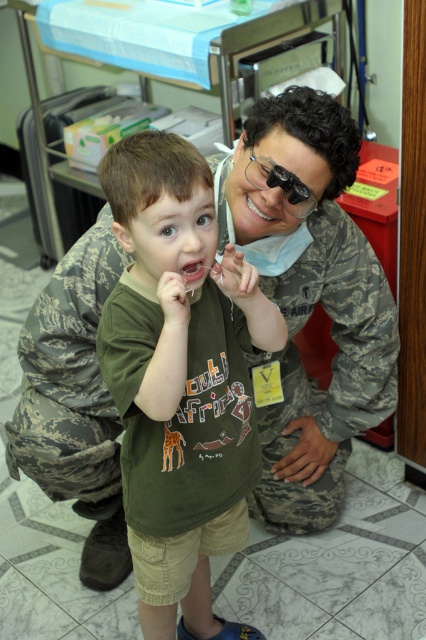
Question: Among these objects, which one is nearest to the camera?

Choices:
 (A) camouflage uniform at center
 (B) green matte shirt at center

Answer: (B)

Question: In this image, where is camouflage uniform at center located relative to green matte shirt at center?

Choices:
 (A) below
 (B) above

Answer: (B)

Question: Which point is closer to the camera?

Choices:
 (A) camouflage uniform at center
 (B) green matte shirt at center

Answer: (B)

Question: Is camouflage uniform at center positioned before green matte shirt at center?

Choices:
 (A) no
 (B) yes

Answer: (A)

Question: Can you confirm if camouflage uniform at center is wider than green matte shirt at center?

Choices:
 (A) yes
 (B) no

Answer: (A)